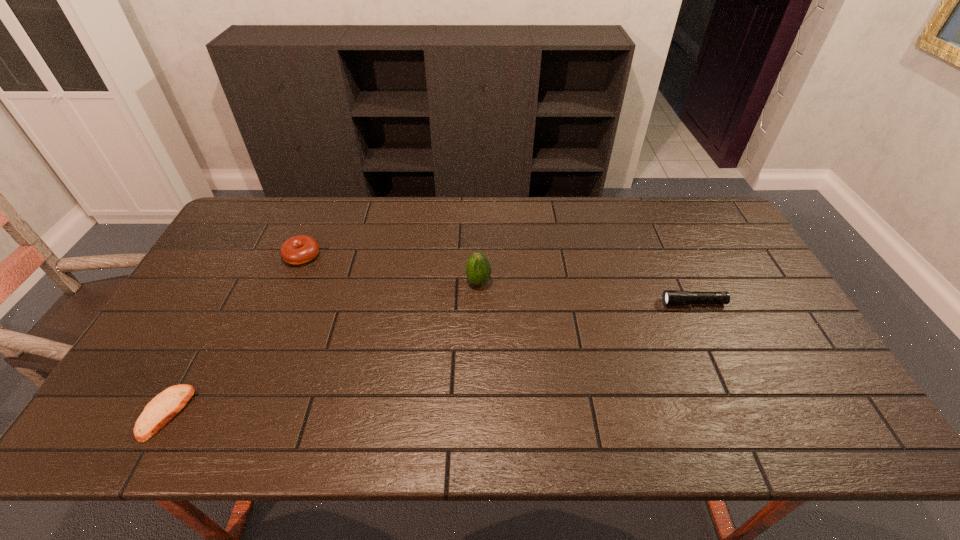
Locate an element on the screen. the second farthest object is located at coordinates (478, 269).

Identify the location of the third object from left to right. (478, 269).

Identify the location of the farthest object. This screenshot has height=540, width=960. (300, 249).

You are a GUI agent. You are given a task and a screenshot of the screen. Output one action in this format:
    pyautogui.click(x=<x>, y=<y>)
    Task: Click on the doughnut
    Image resolution: width=960 pixels, height=540 pixels.
    Given the screenshot: What is the action you would take?
    pyautogui.click(x=300, y=249)

In order to click on flashlight in this screenshot , I will do `click(669, 297)`.

Where is `the rightmost object`? the rightmost object is located at coordinates (669, 297).

The height and width of the screenshot is (540, 960). I want to click on pita bread, so click(x=166, y=405).

This screenshot has width=960, height=540. I want to click on the nearest object, so click(x=166, y=405).

Locate an element on the screen. free space located 0.230m on the left of the third nearest object is located at coordinates (389, 282).

Where is `vacant region located 0.200m on the right of the farthest object`? The image size is (960, 540). vacant region located 0.200m on the right of the farthest object is located at coordinates (383, 255).